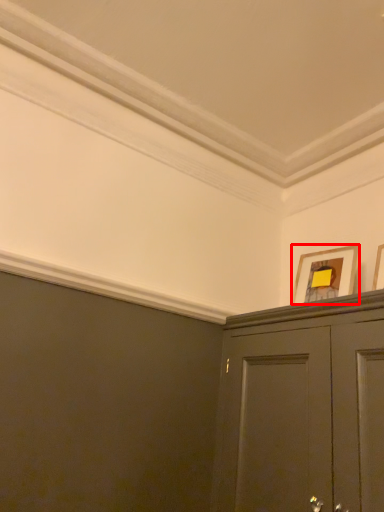
Question: Considering the relative positions of picture frame (annotated by the red box) and picture frame in the image provided, where is picture frame (annotated by the red box) located with respect to the staircase?

Choices:
 (A) right
 (B) left

Answer: (B)